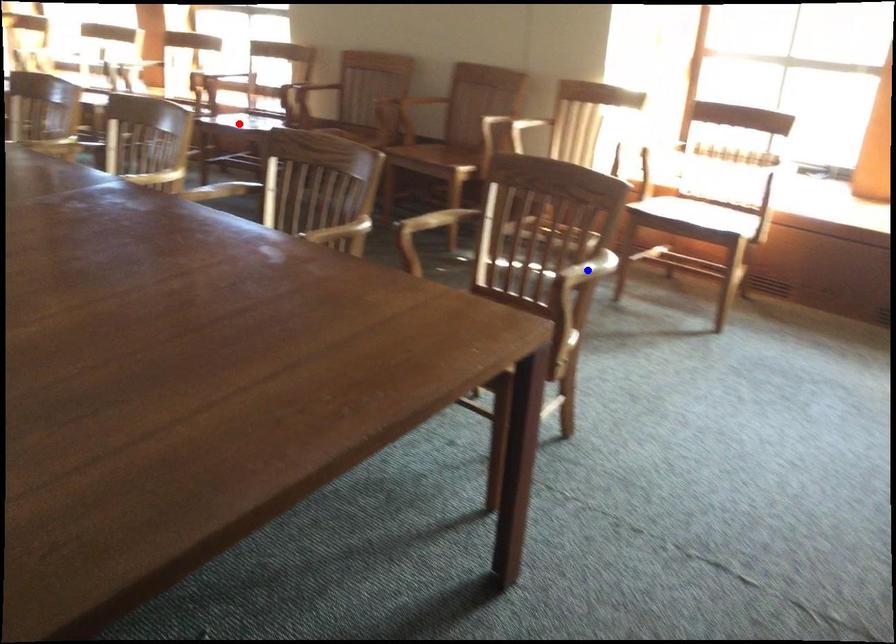
Question: In the image, two points are highlighted. Which point is nearer to the camera? Reply with the corresponding letter.

Choices:
 (A) blue point
 (B) red point

Answer: (A)